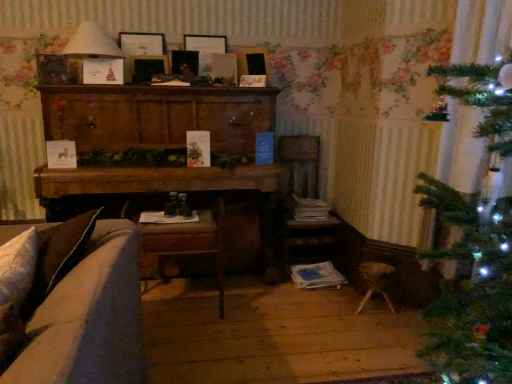
Identify the location of free point below woodenchair at lower center (from a real-world perspective). Image resolution: width=512 pixels, height=384 pixels. (174, 311).